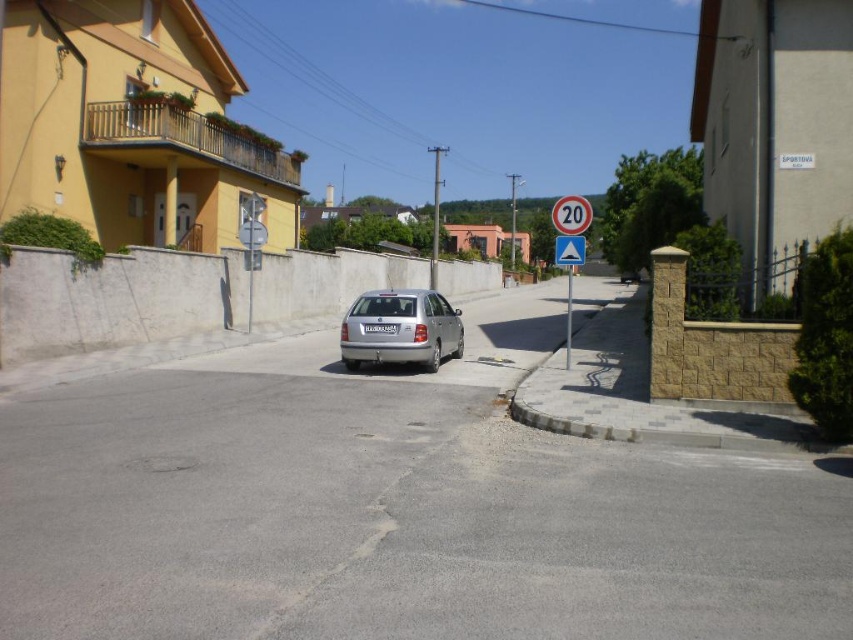
Is silver metallic car at center positioned in front of reflective plastic yield sign at center?

No, it is not.

Does silver metallic car at center appear on the left side of reflective plastic yield sign at center?

Correct, you'll find silver metallic car at center to the left of reflective plastic yield sign at center.

Who is more forward, [355,360] or [561,248]?

Positioned in front is point [561,248].

The width and height of the screenshot is (853, 640). I want to click on silver metallic car at center, so click(399, 328).